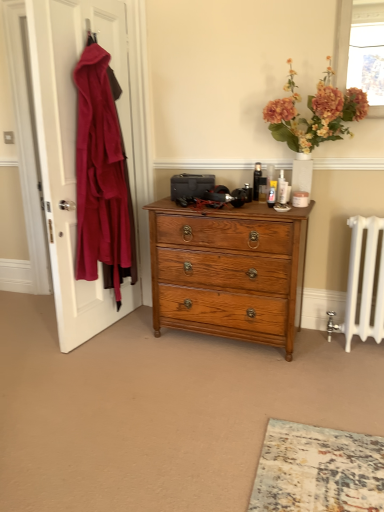
What is the approximate width of velvet red coat at left?

It is 4.79 inches.

I want to click on matte orange flowers at upper right, so click(x=314, y=113).

The width and height of the screenshot is (384, 512). I want to click on velvet red coat at left, so click(75, 151).

From the image's perspective, which is below, translucent glass window screen at upper right or matte orange flowers at upper right?

matte orange flowers at upper right.

Measure the distance between translucent glass window screen at upper right and matte orange flowers at upper right.

They are 10.42 inches apart.

From a real-world perspective, who is located lower, translucent glass window screen at upper right or matte orange flowers at upper right?

matte orange flowers at upper right.

Find the location of a particular element. The image size is (384, 512). window screen located behind the matte orange flowers at upper right is located at coordinates (342, 42).

Are translucent glass window screen at upper right and velvet red coat at left far apart?

translucent glass window screen at upper right is far away from velvet red coat at left.

Is translucent glass window screen at upper right facing towards velvet red coat at left?

No, translucent glass window screen at upper right is not aimed at velvet red coat at left.

Which is in front, translucent glass window screen at upper right or velvet red coat at left?

velvet red coat at left is more forward.

Is matte orange flowers at upper right positioned before shiny oak chest of drawers at center?

Yes.

Is matte orange flowers at upper right positioned with its back to shiny oak chest of drawers at center?

No, matte orange flowers at upper right's orientation is not away from shiny oak chest of drawers at center.

Where is `chest of drawers below the matte orange flowers at upper right (from the image's perspective)`? chest of drawers below the matte orange flowers at upper right (from the image's perspective) is located at coordinates (228, 271).

Is matte orange flowers at upper right thinner than shiny oak chest of drawers at center?

Indeed, matte orange flowers at upper right has a lesser width compared to shiny oak chest of drawers at center.

Consider the image. Is translucent glass window screen at upper right inside or outside of shiny oak chest of drawers at center?

translucent glass window screen at upper right is spatially situated outside shiny oak chest of drawers at center.

Relative to shiny oak chest of drawers at center, is translucent glass window screen at upper right in front or behind?

Visually, translucent glass window screen at upper right is located behind shiny oak chest of drawers at center.

From the image's perspective, which is above, translucent glass window screen at upper right or shiny oak chest of drawers at center?

translucent glass window screen at upper right appears higher in the image.

Are shiny oak chest of drawers at center and velvet red coat at left far apart?

No, there isn't a large distance between shiny oak chest of drawers at center and velvet red coat at left.

Consider the image. Is shiny oak chest of drawers at center behind velvet red coat at left?

That is True.

Considering the relative positions of shiny oak chest of drawers at center and velvet red coat at left in the image provided, is shiny oak chest of drawers at center to the right of velvet red coat at left from the viewer's perspective?

Correct, you'll find shiny oak chest of drawers at center to the right of velvet red coat at left.

Considering the sizes of objects shiny oak chest of drawers at center and velvet red coat at left in the image provided, who is shorter, shiny oak chest of drawers at center or velvet red coat at left?

Standing shorter between the two is shiny oak chest of drawers at center.

Between shiny oak chest of drawers at center and matte orange flowers at upper right, which one has more height?

shiny oak chest of drawers at center is taller.

From the image's perspective, which is above, shiny oak chest of drawers at center or matte orange flowers at upper right?

From the image's view, matte orange flowers at upper right is above.

Which is more to the left, shiny oak chest of drawers at center or matte orange flowers at upper right?

From the viewer's perspective, shiny oak chest of drawers at center appears more on the left side.

Looking at this image, from the image's perspective, is shiny oak chest of drawers at center positioned above or below translucent glass window screen at upper right?

shiny oak chest of drawers at center is below translucent glass window screen at upper right.

Is shiny oak chest of drawers at center located outside translucent glass window screen at upper right?

shiny oak chest of drawers at center is positioned outside translucent glass window screen at upper right.

In the scene shown: Can you confirm if shiny oak chest of drawers at center is smaller than translucent glass window screen at upper right?

Actually, shiny oak chest of drawers at center might be larger than translucent glass window screen at upper right.

Between shiny oak chest of drawers at center and translucent glass window screen at upper right, which one has larger width?

shiny oak chest of drawers at center.

Identify the location of window screen above the matte orange flowers at upper right (from a real-world perspective). (342, 42).

Identify the location of window screen behind the velvet red coat at left. This screenshot has height=512, width=384. (342, 42).

When comparing their distances from velvet red coat at left, does shiny oak chest of drawers at center or matte orange flowers at upper right seem closer?

shiny oak chest of drawers at center.

Looking at the image, which one is located closer to shiny oak chest of drawers at center, matte orange flowers at upper right or translucent glass window screen at upper right?

The object closer to shiny oak chest of drawers at center is matte orange flowers at upper right.

Which object lies nearer to the anchor point velvet red coat at left, matte orange flowers at upper right or translucent glass window screen at upper right?

matte orange flowers at upper right.

Looking at the image, which one is located closer to matte orange flowers at upper right, shiny oak chest of drawers at center or translucent glass window screen at upper right?

translucent glass window screen at upper right lies closer to matte orange flowers at upper right than the other object.

From the image, which object appears to be farther from matte orange flowers at upper right, translucent glass window screen at upper right or velvet red coat at left?

Among the two, velvet red coat at left is located further to matte orange flowers at upper right.

When comparing their distances from translucent glass window screen at upper right, does matte orange flowers at upper right or velvet red coat at left seem closer?

The object closer to translucent glass window screen at upper right is matte orange flowers at upper right.

Considering their positions, is velvet red coat at left positioned closer to translucent glass window screen at upper right than shiny oak chest of drawers at center?

shiny oak chest of drawers at center is closer to translucent glass window screen at upper right.

When comparing their distances from velvet red coat at left, does shiny oak chest of drawers at center or translucent glass window screen at upper right seem closer?

Among the two, shiny oak chest of drawers at center is located nearer to velvet red coat at left.

At what (x,y) coordinates should I click in order to perform the action: click on chest of drawers between velvet red coat at left and translucent glass window screen at upper right. Please return your answer as a coordinate pair (x, y). This screenshot has height=512, width=384. Looking at the image, I should click on [x=228, y=271].

In order to click on flower between translucent glass window screen at upper right and shiny oak chest of drawers at center vertically in this screenshot , I will do `click(314, 113)`.

What are the coordinates of `flower between velvet red coat at left and translucent glass window screen at upper right in the horizontal direction` in the screenshot? It's located at (314, 113).

The width and height of the screenshot is (384, 512). Find the location of `chest of drawers between velvet red coat at left and matte orange flowers at upper right in the horizontal direction`. chest of drawers between velvet red coat at left and matte orange flowers at upper right in the horizontal direction is located at coordinates (228, 271).